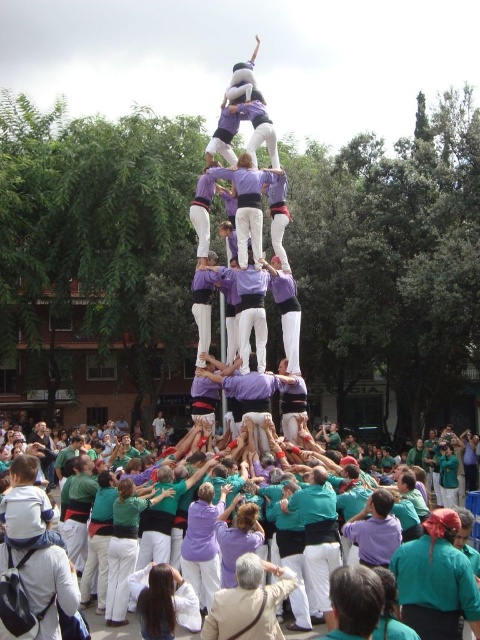
Can you confirm if teal fabric shirt at center is shorter than purple fabric crowd at lower left?

In fact, teal fabric shirt at center may be taller than purple fabric crowd at lower left.

Between teal fabric shirt at center and purple fabric crowd at lower left, which one is positioned higher?

teal fabric shirt at center

Who is more distant from viewer, (313,547) or (99,628)?

The point (313,547) is more distant.

The width and height of the screenshot is (480, 640). In order to click on teal fabric shirt at center in this screenshot , I will do `click(317, 534)`.